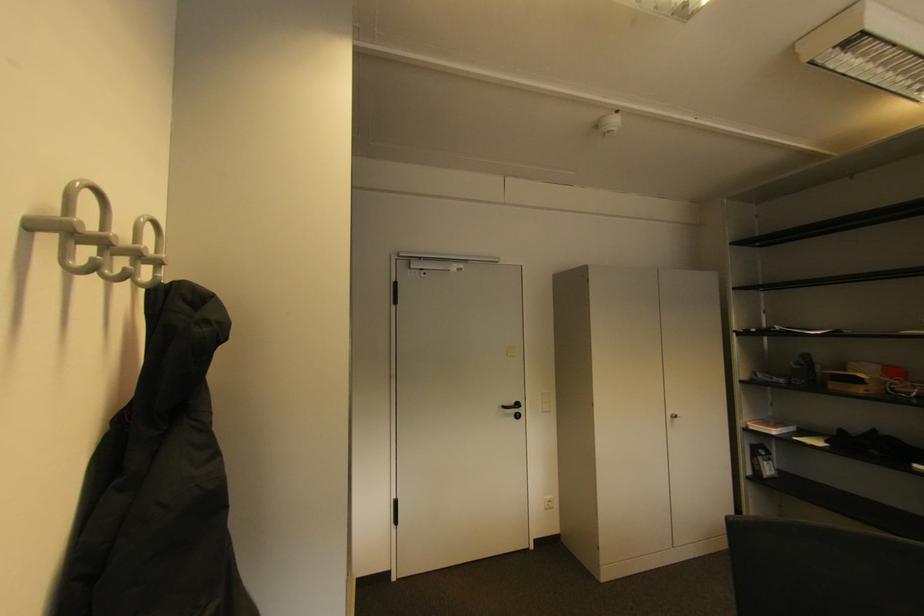
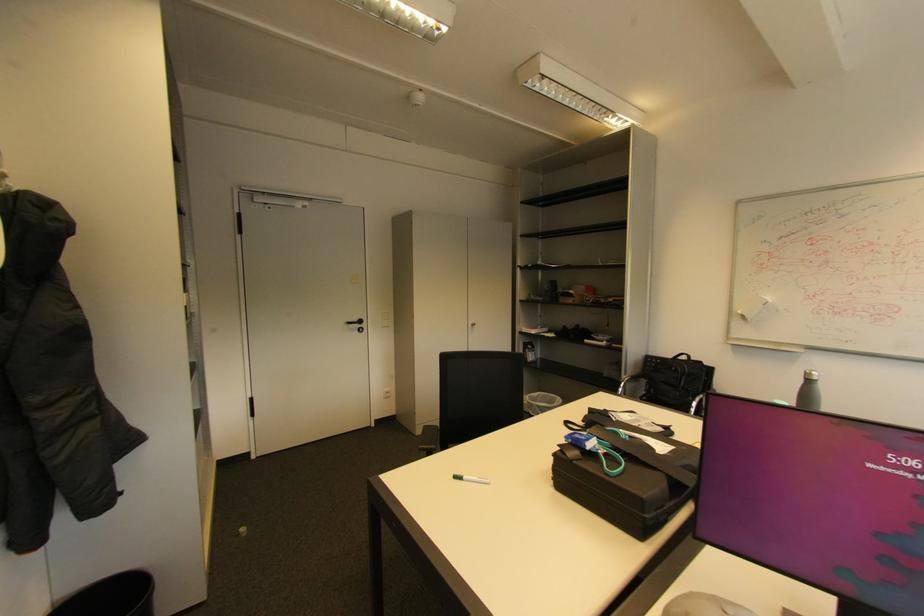
Question: How did the camera likely rotate?

Choices:
 (A) Left
 (B) Right
 (C) Up
 (D) Down

Answer: (B)